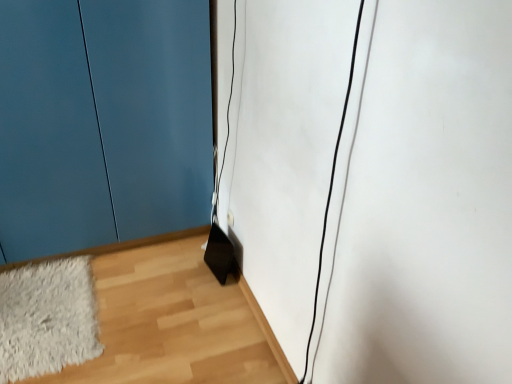
Question: Is matte blue door at lower left at the right side of white fluffy rug at lower left?

Choices:
 (A) no
 (B) yes

Answer: (B)

Question: Considering the relative positions of matte blue door at lower left and white fluffy rug at lower left in the image provided, is matte blue door at lower left behind white fluffy rug at lower left?

Choices:
 (A) no
 (B) yes

Answer: (A)

Question: Does matte blue door at lower left have a lesser height compared to white fluffy rug at lower left?

Choices:
 (A) no
 (B) yes

Answer: (A)

Question: Is matte blue door at lower left smaller than white fluffy rug at lower left?

Choices:
 (A) yes
 (B) no

Answer: (B)

Question: From a real-world perspective, does matte blue door at lower left sit lower than white fluffy rug at lower left?

Choices:
 (A) no
 (B) yes

Answer: (A)

Question: Considering the positions of point (122, 173) and point (47, 357), is point (122, 173) closer or farther from the camera than point (47, 357)?

Choices:
 (A) farther
 (B) closer

Answer: (A)

Question: In terms of width, does matte blue door at lower left look wider or thinner when compared to white fluffy rug at lower left?

Choices:
 (A) thin
 (B) wide

Answer: (B)

Question: Is matte blue door at lower left inside the boundaries of white fluffy rug at lower left, or outside?

Choices:
 (A) inside
 (B) outside

Answer: (B)

Question: Considering their positions, is matte blue door at lower left located in front of or behind white fluffy rug at lower left?

Choices:
 (A) behind
 (B) front

Answer: (B)

Question: Is point (111, 251) positioned closer to the camera than point (86, 266)?

Choices:
 (A) closer
 (B) farther

Answer: (B)

Question: Is wooden floor at lower right wider or thinner than white fluffy rug at lower left?

Choices:
 (A) wide
 (B) thin

Answer: (A)

Question: Considering the positions of wooden floor at lower right and white fluffy rug at lower left in the image, is wooden floor at lower right taller or shorter than white fluffy rug at lower left?

Choices:
 (A) short
 (B) tall

Answer: (B)

Question: Do you think wooden floor at lower right is within white fluffy rug at lower left, or outside of it?

Choices:
 (A) outside
 (B) inside

Answer: (A)

Question: In terms of width, does white fluffy rug at lower left look wider or thinner when compared to matte blue door at lower left?

Choices:
 (A) thin
 (B) wide

Answer: (A)

Question: In terms of size, does white fluffy rug at lower left appear bigger or smaller than matte blue door at lower left?

Choices:
 (A) small
 (B) big

Answer: (A)